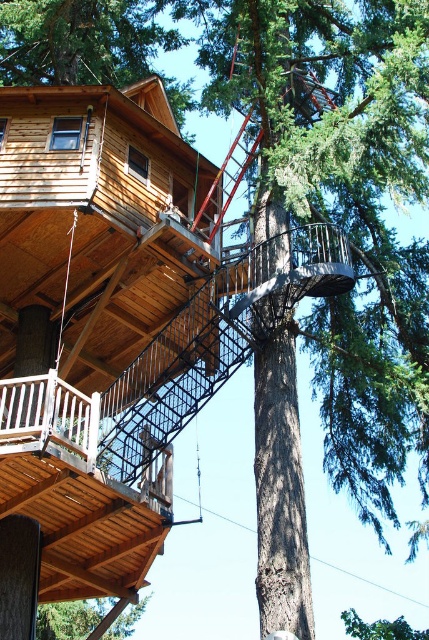
Measure the distance between green wood tree at lower left and green leafy tree at upper center.

green wood tree at lower left is 37.33 meters away from green leafy tree at upper center.

In the scene shown: Is green wood tree at lower left to the left of green leafy tree at upper center from the viewer's perspective?

Yes, green wood tree at lower left is to the left of green leafy tree at upper center.

The height and width of the screenshot is (640, 429). I want to click on green wood tree at lower left, so click(x=69, y=618).

What are the coordinates of `green wood tree at lower left` in the screenshot? It's located at (69, 618).